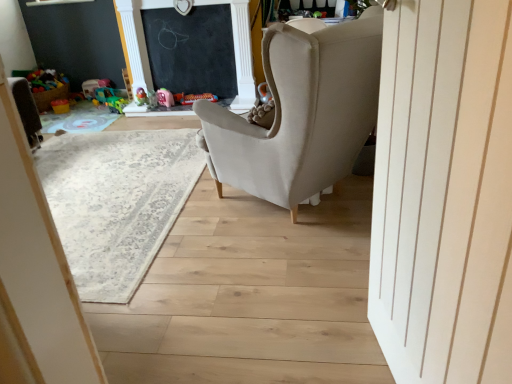
Question: Is rubberized green toy at center, the second toy in the left-to-right sequence, wider or thinner than rubberized green toy at upper left, the 4th toy in the right-to-left sequence?

Choices:
 (A) wide
 (B) thin

Answer: (B)

Question: In the image, is rubberized green toy at center, which is the fifth toy in right-to-left order, positioned in front of or behind rubberized green toy at upper left, the 4th toy in the right-to-left sequence?

Choices:
 (A) front
 (B) behind

Answer: (B)

Question: Estimate the real-world distances between objects in this image. Which object is farther from the black chalkboard at upper center?

Choices:
 (A) rubberized green toy at upper left, the 4th toy in the right-to-left sequence
 (B) rubberized green toy at center, which is the fifth toy in right-to-left order
 (C) beige carpet at center
 (D) matte orange toy at center, placed as the sixth toy when sorted from right to left
 (E) pink rubber duck at upper center, which is the third toy in right-to-left order

Answer: (C)

Question: Which object is the closest to the pink rubber duck at upper center, which is the third toy in right-to-left order?

Choices:
 (A) rubberized green toy at upper left, the 4th toy in the right-to-left sequence
 (B) rubberized green toy at center, the second toy in the left-to-right sequence
 (C) black chalkboard at upper center
 (D) beige carpet at center
 (E) matte gray plush toy at upper center, which is the 6th toy from left to right

Answer: (A)